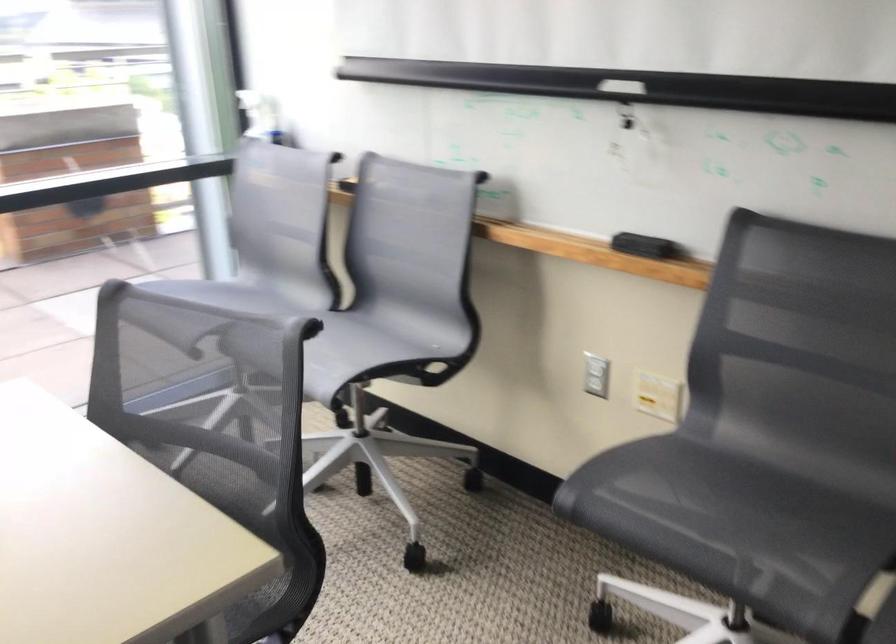
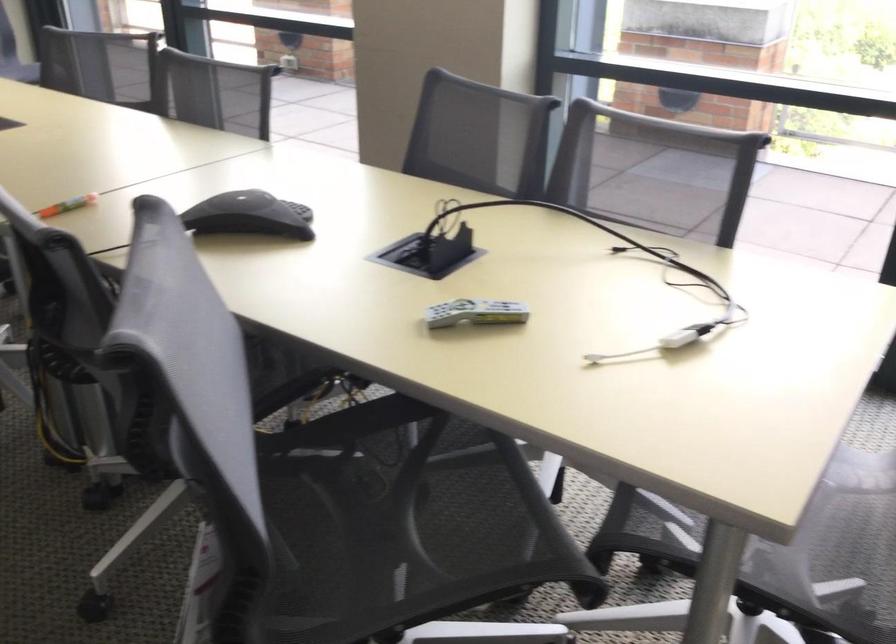
The images are taken continuously from a first-person perspective. In which direction is your viewpoint rotating?

The camera rotated toward left-down.